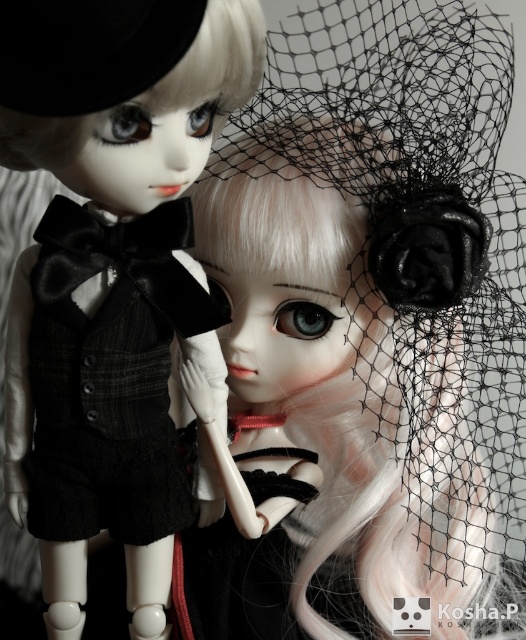
Looking at this image, you are a collector organizing a doll display. You have a satin black doll at center and a velvet black vest at left. According to the scene, which object is positioned to the left?

The velvet black vest at left is positioned to the left of the satin black doll at center.

You are a fashion designer observing two dolls. You notice the matte black veil at upper right and the black velvet hat at upper left. Which of these two items is located more to the left?

The matte black veil at upper right is positioned more to the left than the black velvet hat at upper left.